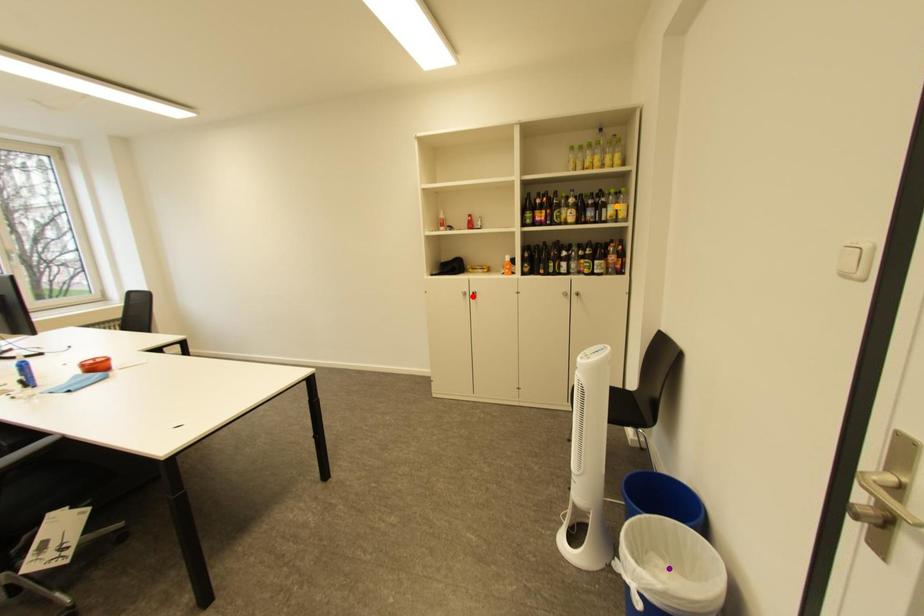
Order these from nearest to farthest:
orange point, red point, purple point

purple point, orange point, red point